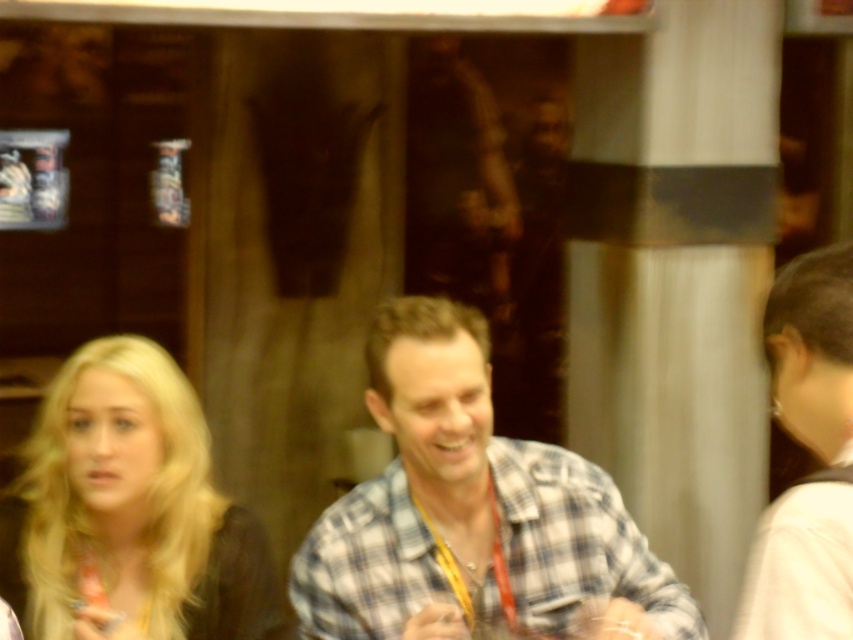
You are a photographer who needs to adjust the distance between the plaid fabric shirt at center and the camera to ensure proper focus. The optimal distance for your lens is 1.6 meters. Based on the scene, is the current distance sufficient?

The plaid fabric shirt at center and camera are 1.57 meters apart, which is slightly less than the optimal 1.6 meters. Adjust the distance by moving the camera or subject to achieve the desired focus.

You are a photographer at an event and need to capture a group photo of the plaid fabric shirt at center and the white fabric hair at right. The camera you are using has a minimum focus distance of 20 inches. Can you take a clear photo of both subjects without moving them?

The plaid fabric shirt at center is 22.75 inches from the white fabric hair at right. Since the distance between them is greater than the camera minimum focus distance of 20 inches, you can take a clear photo of both subjects without moving them.

You are a photographer at an event and need to adjust the camera focus between the blonde hair at center and the white fabric hair at right. Which one should you focus on first if you want to capture both clearly in the same shot?

Since the blonde hair at center is closer to the camera than the white fabric hair at right by 1.10 meters, you should focus on the blonde hair at center first to ensure both are in focus.